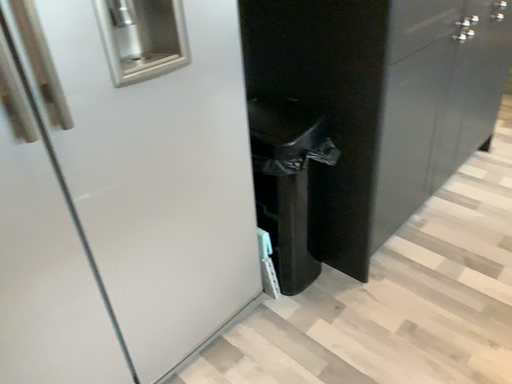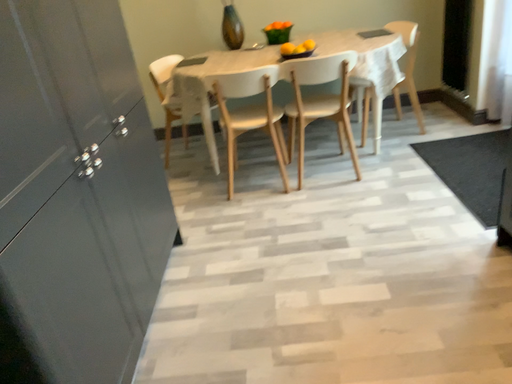
Question: Which way did the camera rotate in the video?

Choices:
 (A) rotated upward
 (B) rotated downward

Answer: (A)